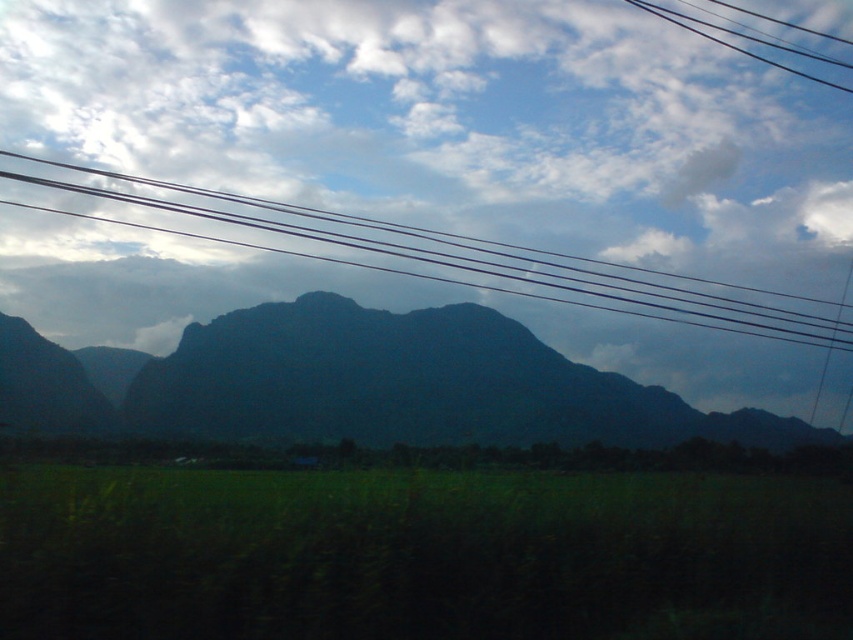
Between green grassy field at lower center and black wires at upper center, which one has more height?

Standing taller between the two is black wires at upper center.

Does green grassy field at lower center appear over black wires at upper center?

Incorrect, green grassy field at lower center is not positioned above black wires at upper center.

Is point (194, 474) positioned behind point (834, 342)?

Yes, it is.

Identify the location of green grassy field at lower center. The height and width of the screenshot is (640, 853). (419, 554).

Does green grassy field at lower center have a larger size compared to dark green mountain at center?

Incorrect, green grassy field at lower center is not larger than dark green mountain at center.

Can you confirm if green grassy field at lower center is taller than dark green mountain at center?

No.

What do you see at coordinates (419, 554) in the screenshot? The image size is (853, 640). I see `green grassy field at lower center` at bounding box center [419, 554].

At what (x,y) coordinates should I click in order to perform the action: click on green grassy field at lower center. Please return your answer as a coordinate pair (x, y). This screenshot has width=853, height=640. Looking at the image, I should click on (419, 554).

Can you confirm if dark green mountain at center is thinner than black wires at upper center?

Yes.

Is dark green mountain at center to the left of black wires at upper center from the viewer's perspective?

Correct, you'll find dark green mountain at center to the left of black wires at upper center.

This screenshot has width=853, height=640. Identify the location of dark green mountain at center. (364, 385).

Image resolution: width=853 pixels, height=640 pixels. I want to click on dark green mountain at center, so click(x=364, y=385).